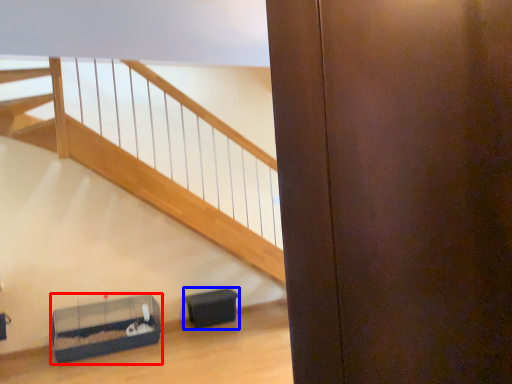
Question: Which of the following is the farthest to the observer, furniture (highlighted by a red box) or furniture (highlighted by a blue box)?

Choices:
 (A) furniture
 (B) furniture

Answer: (B)